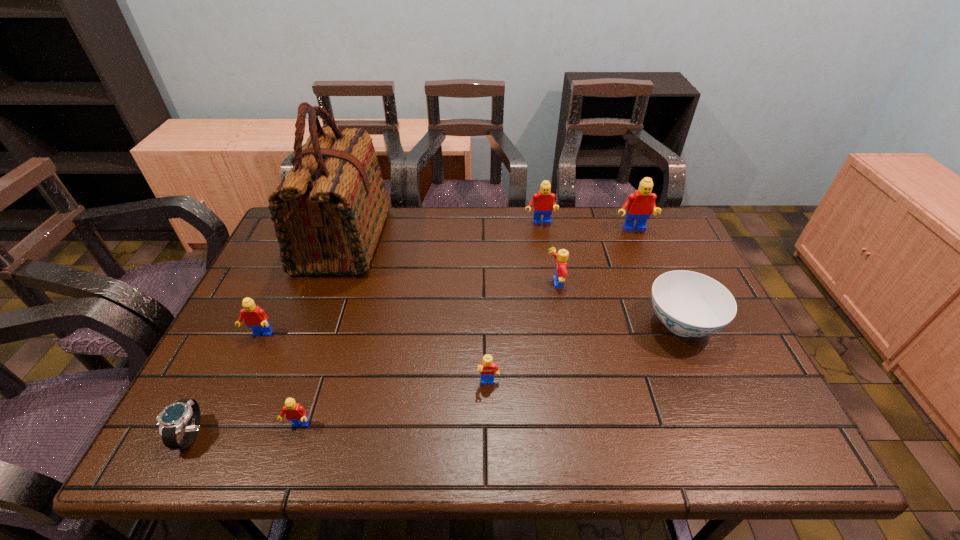
Locate an element on the screen. free location that satisfies the following two spatial constraints: 1. on the face of the third farthest Lego; 2. on the front-facing side of the nearest red Lego is located at coordinates (580, 426).